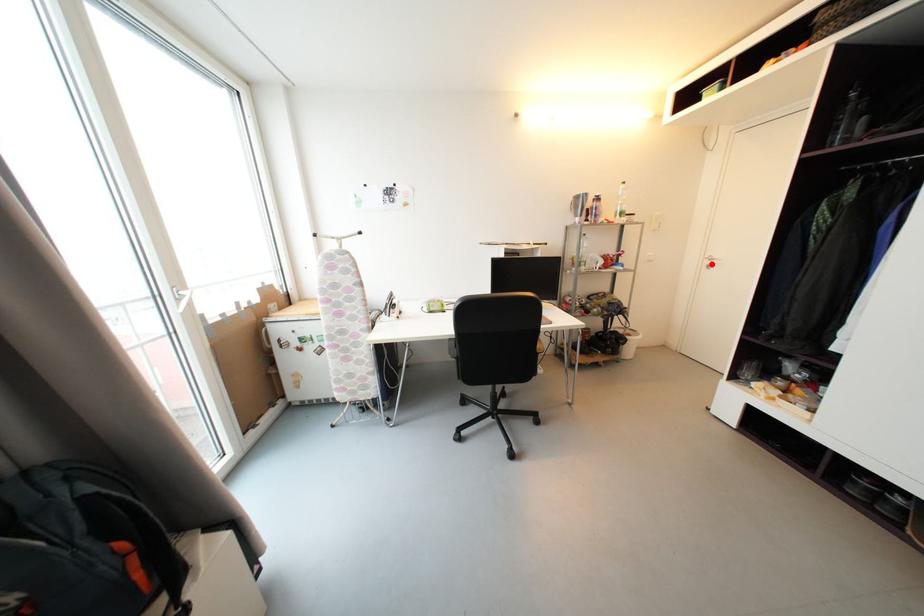
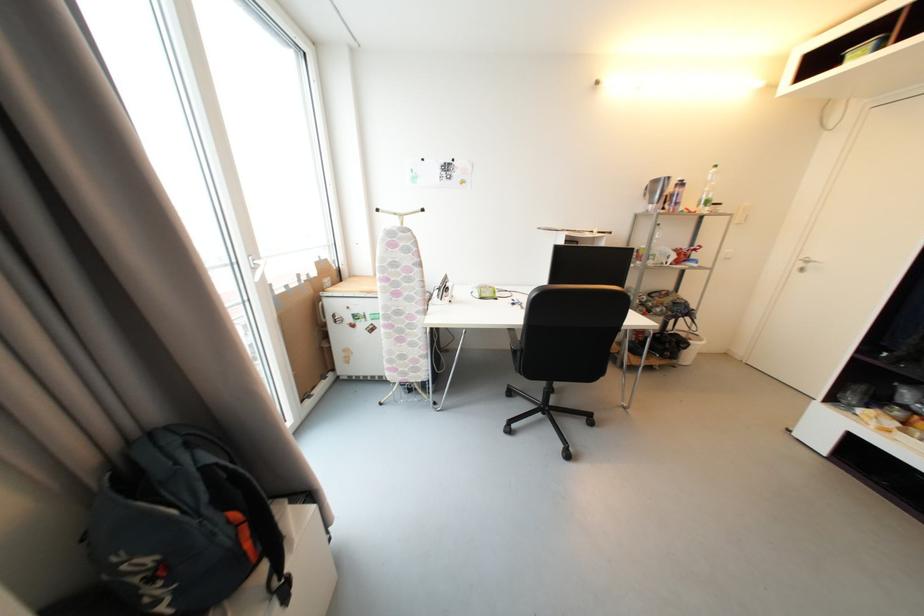
Find the pixel in the second image that matches the highlighted location in the first image.

(806, 267)